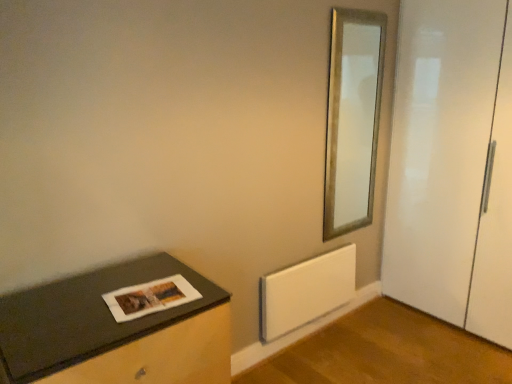
This screenshot has height=384, width=512. I want to click on vacant space situated above dark gray matte table at lower left (from a real-world perspective), so click(x=129, y=302).